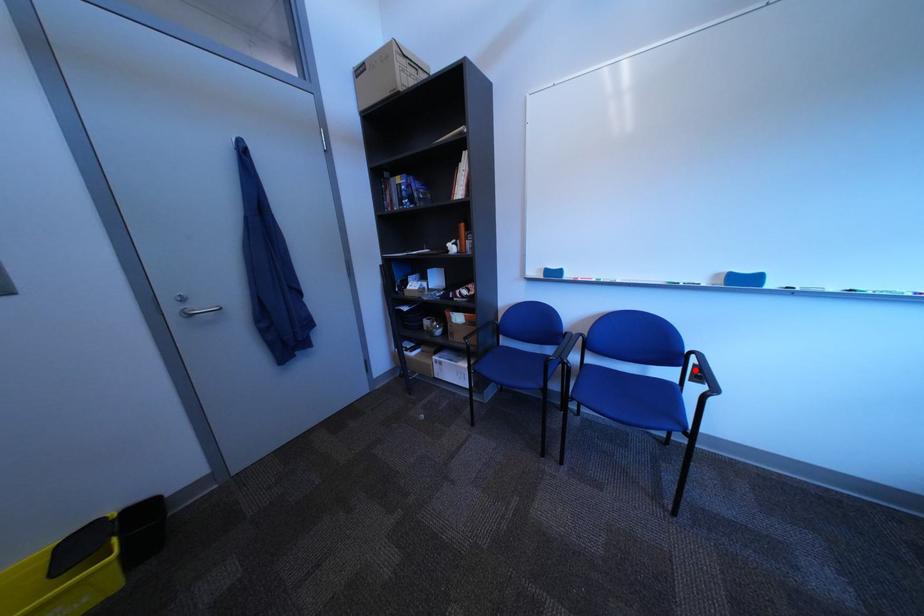
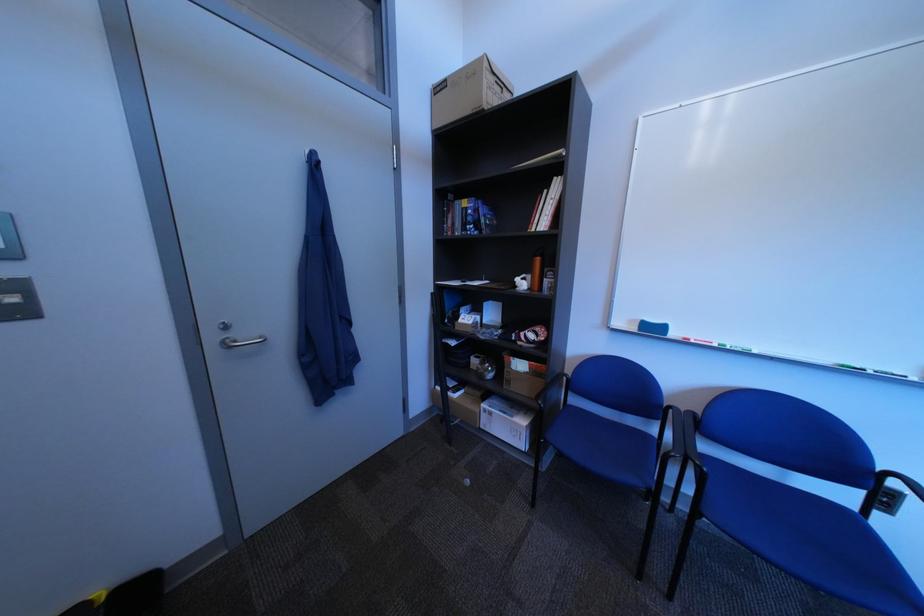
In the second image, find the point that corresponds to the highlighted location in the first image.

(881, 493)